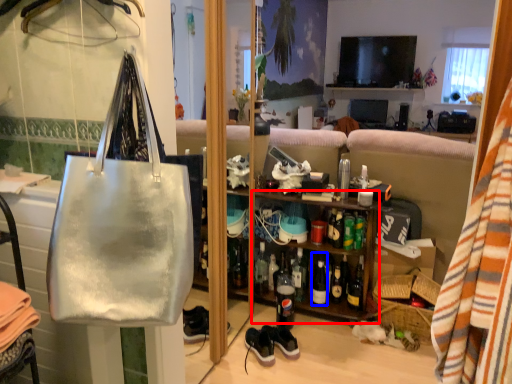
Question: Among these objects, which one is farthest to the camera, shelf (highlighted by a red box) or bottle (highlighted by a blue box)?

Choices:
 (A) shelf
 (B) bottle

Answer: (B)